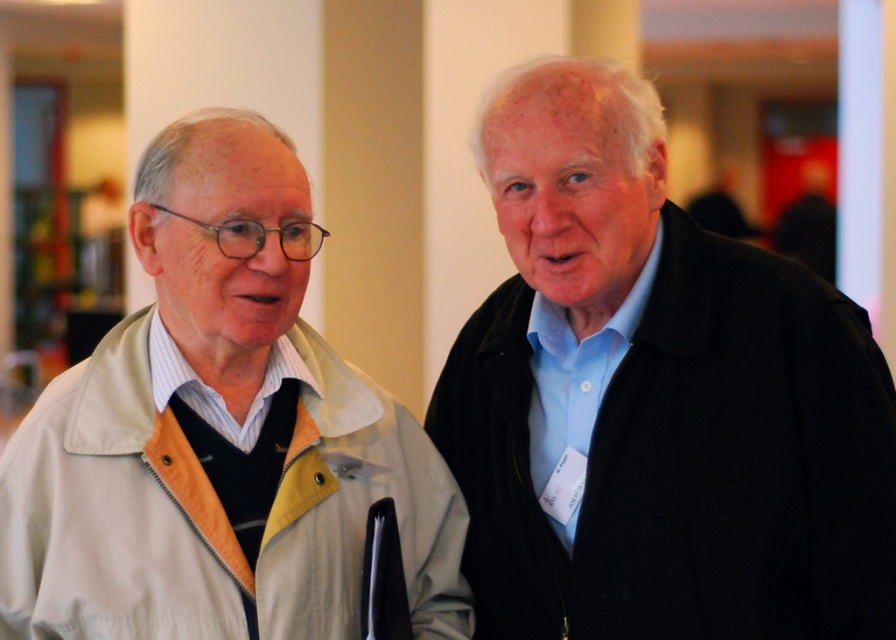
Is light beige jacket at left positioned behind black woolen coat at right?

No.

Does light beige jacket at left appear on the left side of black woolen coat at right?

Yes, light beige jacket at left is to the left of black woolen coat at right.

Is point (302, 232) behind point (745, 481)?

Yes, point (302, 232) is behind point (745, 481).

This screenshot has width=896, height=640. Identify the location of light beige jacket at left. (220, 435).